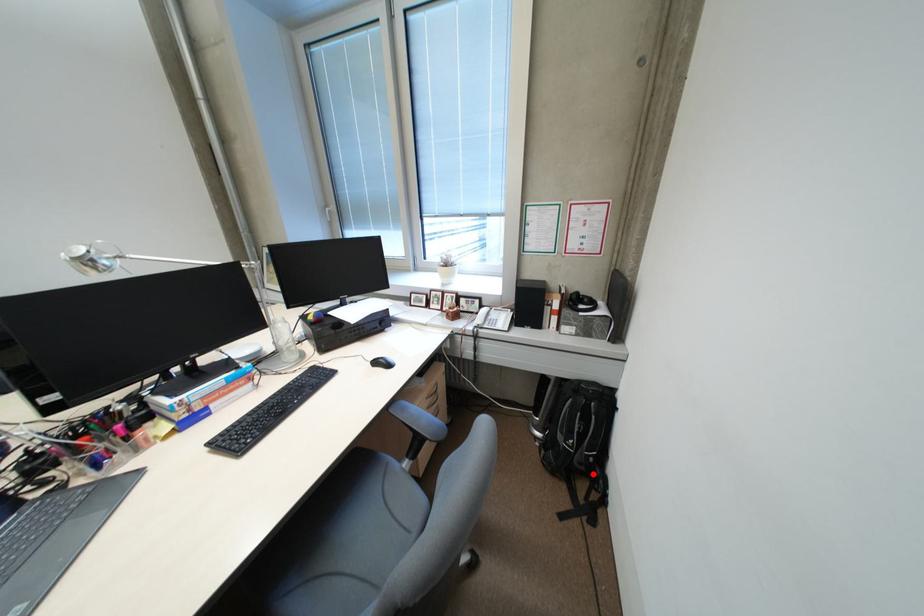
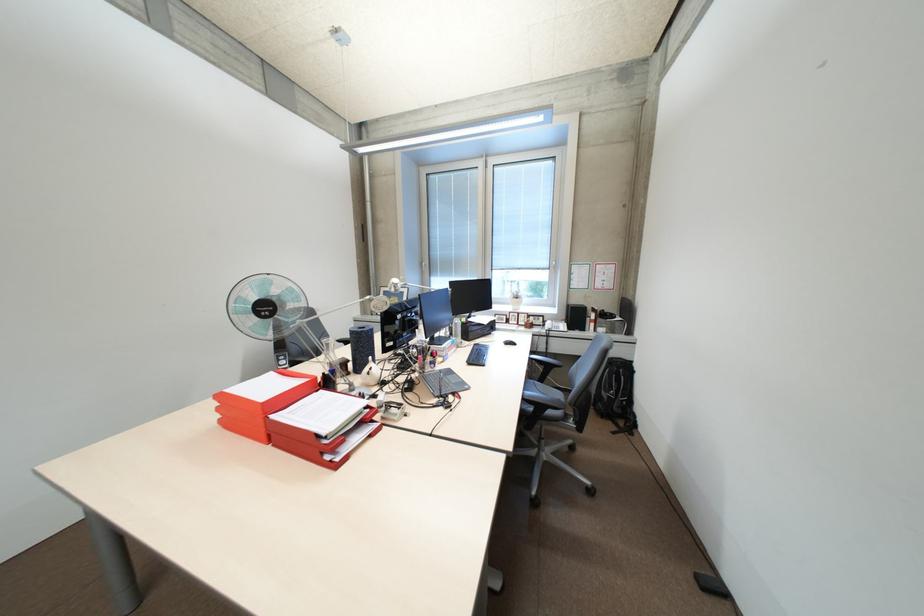
Question: I am providing you with two images of the same scene from different viewpoints. Given a red point in image1, look at the same physical point in image2. Is it:

Choices:
 (A) Closer to the viewpoint
 (B) Farther from the viewpoint

Answer: (A)